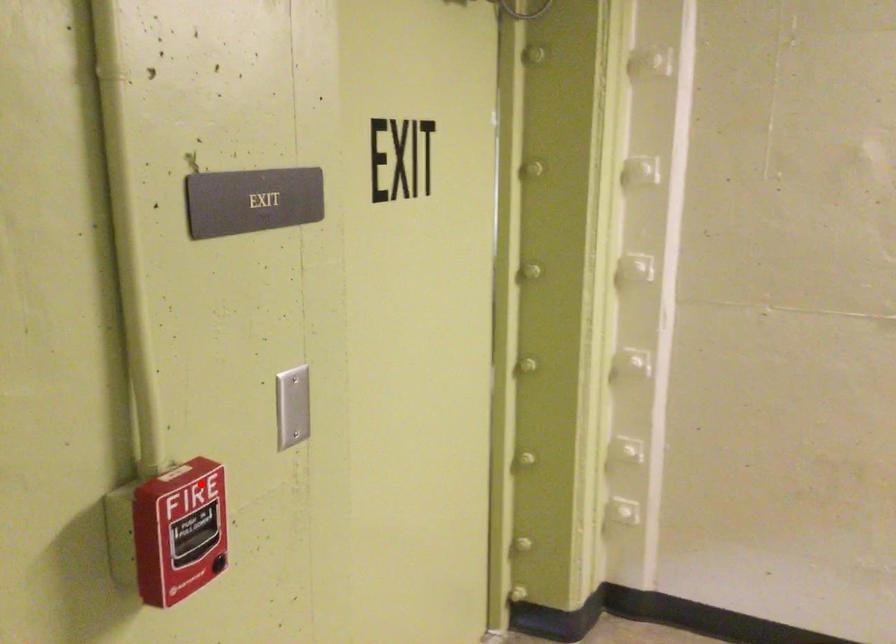
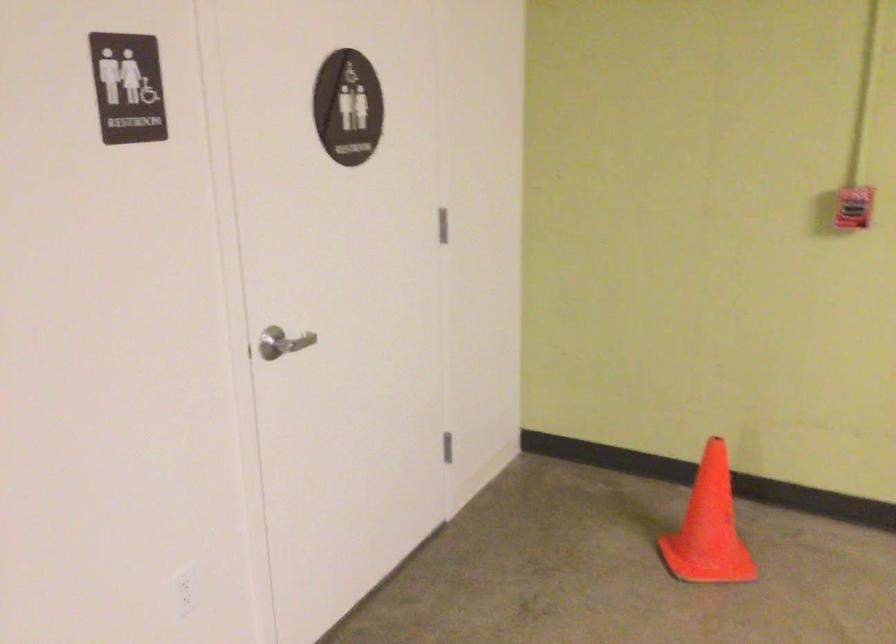
Question: I am providing you with two images of the same scene from different viewpoints. In image1, a red point is highlighted. Considering the same 3D point in image2, which of the following is correct?

Choices:
 (A) It is closer
 (B) It is farther

Answer: (B)